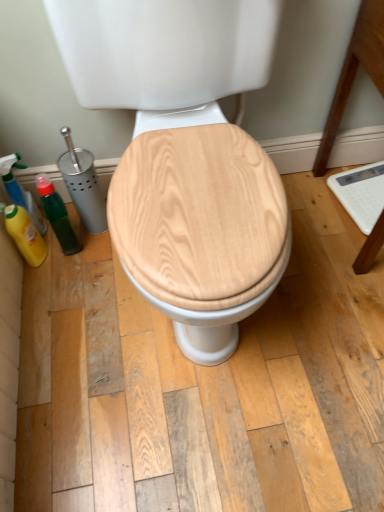
Question: Is green matte bottle at left far from wooden toilet seat at center?

Choices:
 (A) yes
 (B) no

Answer: (B)

Question: Is green matte bottle at left at the right side of wooden toilet seat at center?

Choices:
 (A) yes
 (B) no

Answer: (B)

Question: Is green matte bottle at left taller than wooden toilet seat at center?

Choices:
 (A) yes
 (B) no

Answer: (B)

Question: Does green matte bottle at left have a lesser height compared to wooden toilet seat at center?

Choices:
 (A) no
 (B) yes

Answer: (B)

Question: From the image's perspective, is green matte bottle at left on top of wooden toilet seat at center?

Choices:
 (A) yes
 (B) no

Answer: (B)

Question: Based on their positions, is green matte bottle at left located to the left or right of matte green spray bottle at left, marked as the 2th cleaning product in a bottom-to-top arrangement?

Choices:
 (A) left
 (B) right

Answer: (B)

Question: From a real-world perspective, relative to matte green spray bottle at left, the first cleaning product when ordered from top to bottom, is green matte bottle at left vertically above or below?

Choices:
 (A) below
 (B) above

Answer: (B)

Question: Based on their sizes in the image, would you say green matte bottle at left is bigger or smaller than matte green spray bottle at left, marked as the 2th cleaning product in a bottom-to-top arrangement?

Choices:
 (A) small
 (B) big

Answer: (A)

Question: Looking at their shapes, would you say green matte bottle at left is wider or thinner than matte green spray bottle at left, marked as the 2th cleaning product in a bottom-to-top arrangement?

Choices:
 (A) wide
 (B) thin

Answer: (A)

Question: From the image's perspective, is wooden toilet seat at center above or below green matte bottle at left?

Choices:
 (A) above
 (B) below

Answer: (A)

Question: From their relative heights in the image, would you say wooden toilet seat at center is taller or shorter than green matte bottle at left?

Choices:
 (A) tall
 (B) short

Answer: (A)

Question: From a real-world perspective, relative to green matte bottle at left, is wooden toilet seat at center vertically above or below?

Choices:
 (A) above
 (B) below

Answer: (A)

Question: Is wooden toilet seat at center bigger or smaller than green matte bottle at left?

Choices:
 (A) big
 (B) small

Answer: (A)

Question: Considering the positions of point (x=248, y=80) and point (x=8, y=223), is point (x=248, y=80) closer or farther from the camera than point (x=8, y=223)?

Choices:
 (A) farther
 (B) closer

Answer: (B)

Question: Visually, is wooden toilet seat at center positioned to the left or to the right of yellow matte bottle at left, the 1th cleaning product positioned from the bottom?

Choices:
 (A) right
 (B) left

Answer: (A)